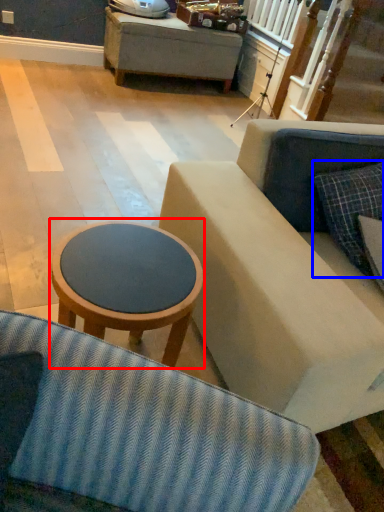
Question: Which of the following is the closest to the observer, table (highlighted by a red box) or pillow (highlighted by a blue box)?

Choices:
 (A) table
 (B) pillow

Answer: (A)